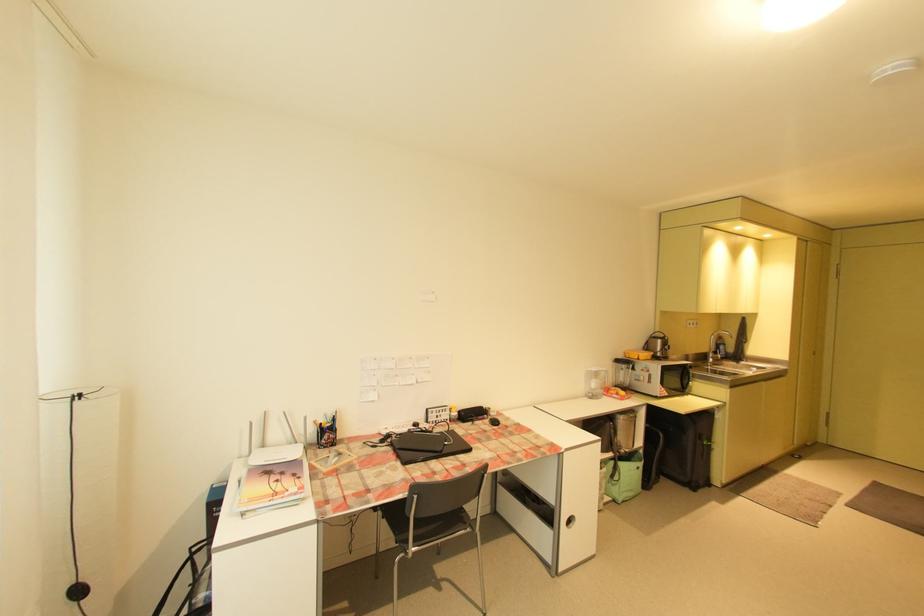
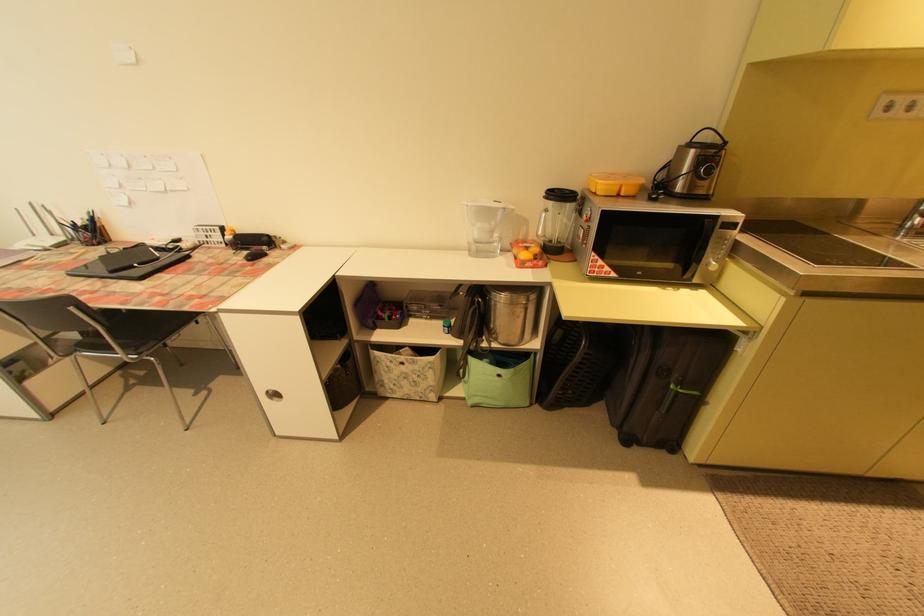
Locate, in the second image, the point that corresponds to point (634, 492) in the first image.

(492, 398)